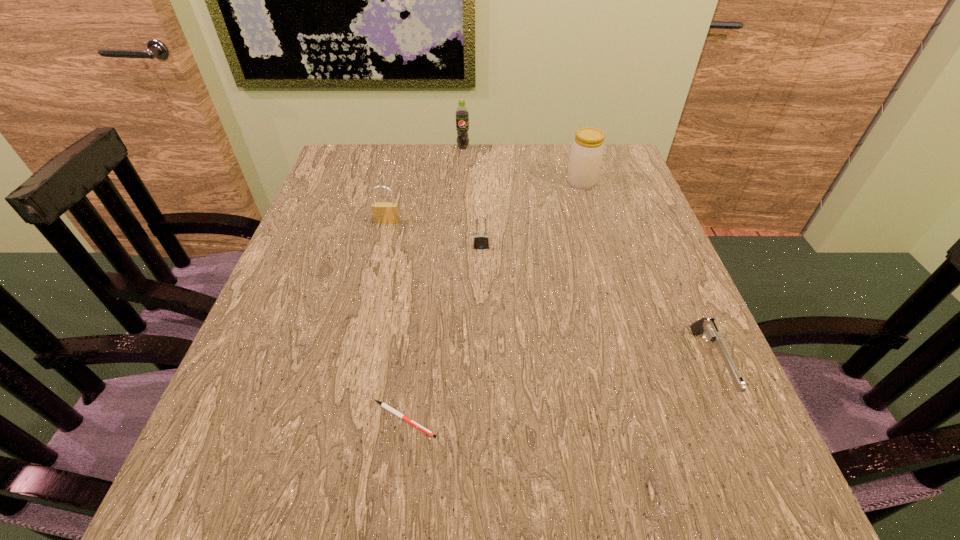
In order to click on the farthest object in this screenshot , I will do `click(462, 115)`.

The height and width of the screenshot is (540, 960). I want to click on the second farthest object, so click(587, 150).

Find the location of a particular element. Image resolution: width=960 pixels, height=540 pixels. the fifth object from left to right is located at coordinates (587, 150).

Where is `the fourth shortest object`? the fourth shortest object is located at coordinates (383, 212).

At what (x,y) coordinates should I click in order to perform the action: click on the farther padlock. Please return your answer as a coordinate pair (x, y). The width and height of the screenshot is (960, 540). Looking at the image, I should click on (383, 212).

Locate an element on the screen. Image resolution: width=960 pixels, height=540 pixels. the third object from right to left is located at coordinates (481, 238).

You are a GUI agent. You are given a task and a screenshot of the screen. Output one action in this format:
    pyautogui.click(x=<x>, y=<y>)
    Task: Click on the shorter padlock
    The width and height of the screenshot is (960, 540).
    Given the screenshot: What is the action you would take?
    pyautogui.click(x=481, y=238)

At what (x,y) coordinates should I click in order to perform the action: click on pistol. Please return your answer as a coordinate pair (x, y). Looking at the image, I should click on (708, 328).

Identify the location of the rightmost object. The height and width of the screenshot is (540, 960). (708, 328).

Identify the location of the shortest object. The width and height of the screenshot is (960, 540). (382, 404).